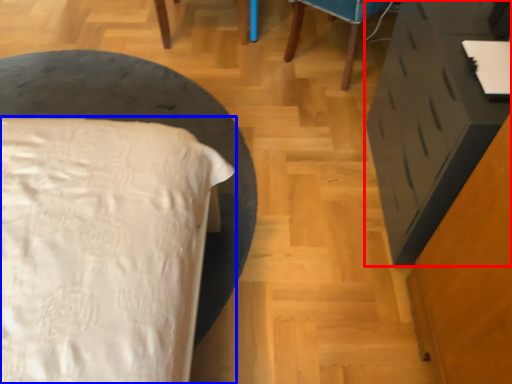
Question: Which object is further to the camera taking this photo, vanity (highlighted by a red box) or bed (highlighted by a blue box)?

Choices:
 (A) vanity
 (B) bed

Answer: (B)